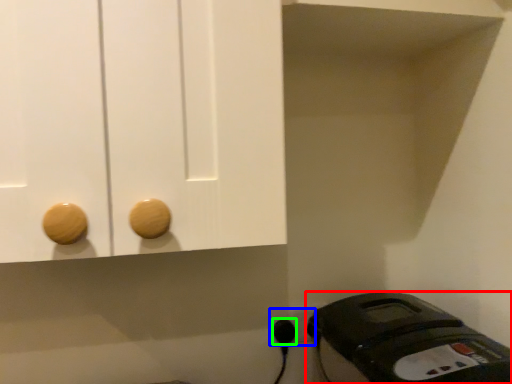
Question: Which object is positioned closest to home appliance (highlighted by a red box)? Select from electric outlet (highlighted by a blue box) and plug (highlighted by a green box).

Choices:
 (A) electric outlet
 (B) plug

Answer: (A)